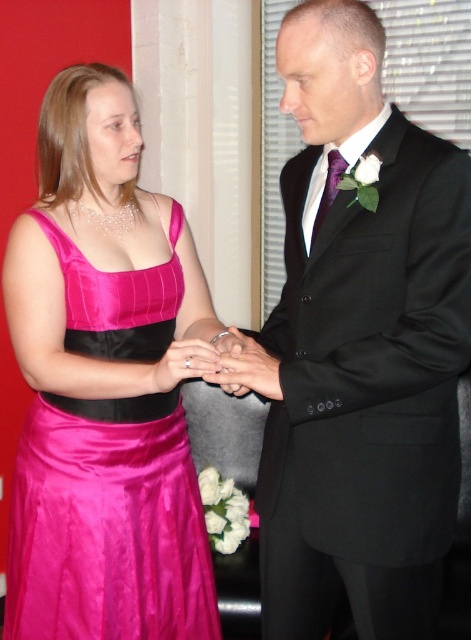
Question: Is shiny pink dress at left below satin pink dress at center?

Choices:
 (A) no
 (B) yes

Answer: (B)

Question: Which point is closer to the camera?

Choices:
 (A) black satin suit at center
 (B) matte black ring at center

Answer: (A)

Question: Which point is closer to the camera?

Choices:
 (A) (261, 355)
 (B) (187, 365)
 (C) (141, 547)
 (D) (179, 349)

Answer: (A)

Question: Which point is closer to the camera?

Choices:
 (A) (238, 364)
 (B) (164, 369)
 (C) (362, 604)

Answer: (A)

Question: Does black satin suit at center have a larger size compared to matte black ring at center?

Choices:
 (A) no
 (B) yes

Answer: (B)

Question: Is black satin suit at center below silver metallic ring at center?

Choices:
 (A) no
 (B) yes

Answer: (A)